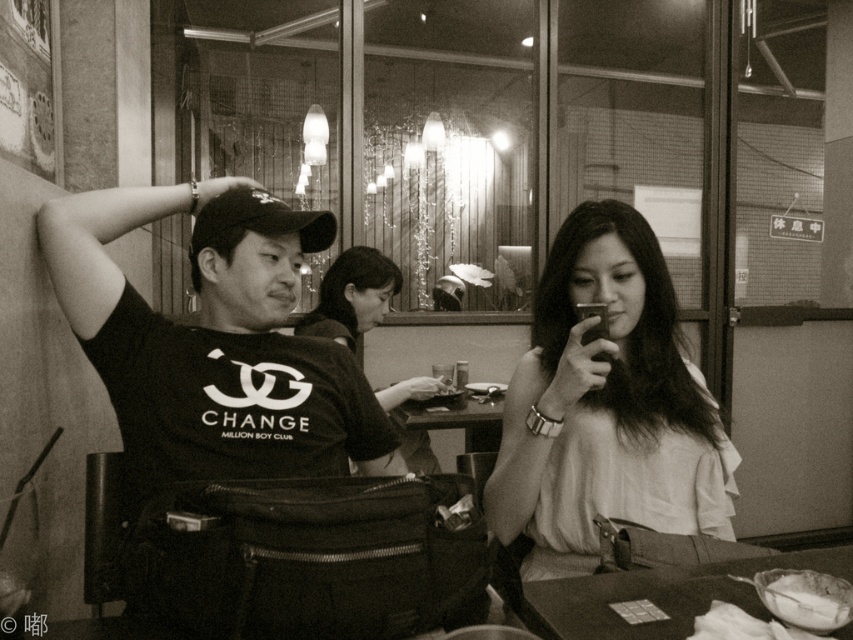
Does black matte cap at upper left lie behind smooth fabric blouse at center?

That is False.

Can you confirm if black matte cap at upper left is positioned to the right of smooth fabric blouse at center?

No, black matte cap at upper left is not to the right of smooth fabric blouse at center.

This screenshot has width=853, height=640. In order to click on black matte cap at upper left in this screenshot , I will do `click(213, 342)`.

Locate an element on the screen. black matte cap at upper left is located at coordinates (213, 342).

Is point (241, 292) positioned after point (601, 509)?

Yes, point (241, 292) is behind point (601, 509).

In the scene shown: Does black matte cap at upper left appear on the left side of white fabric shirt at center?

Yes, black matte cap at upper left is to the left of white fabric shirt at center.

Describe the element at coordinates (213, 342) in the screenshot. I see `black matte cap at upper left` at that location.

You are a GUI agent. You are given a task and a screenshot of the screen. Output one action in this format:
    pyautogui.click(x=<x>, y=<y>)
    Task: Click on the black matte cap at upper left
    The image size is (853, 640).
    Given the screenshot: What is the action you would take?
    pyautogui.click(x=213, y=342)

Is point (671, 576) positioned behind point (799, 582)?

Yes, it is behind point (799, 582).

Which is behind, point (758, 570) or point (753, 577)?

The point (758, 570) is behind.

Image resolution: width=853 pixels, height=640 pixels. In order to click on smooth black table at lower right in this screenshot , I will do `click(659, 595)`.